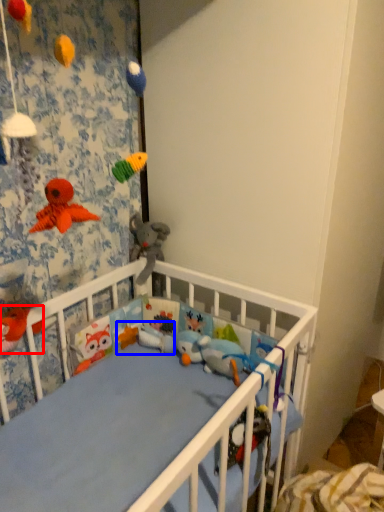
Question: Which of the following is the farthest to the observer, toy (highlighted by a red box) or toy (highlighted by a blue box)?

Choices:
 (A) toy
 (B) toy

Answer: (B)